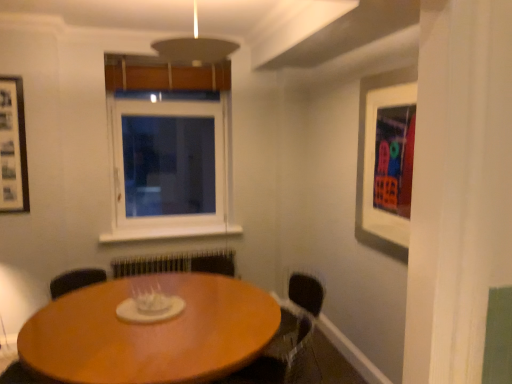
Question: Can you confirm if white matte picture frame at upper right, which is the 1th picture frame in front-to-back order, is shorter than white plastic window at center?

Choices:
 (A) no
 (B) yes

Answer: (B)

Question: Is the depth of white matte picture frame at upper right, which is the 1th picture frame in front-to-back order, greater than that of white plastic window at center?

Choices:
 (A) yes
 (B) no

Answer: (B)

Question: Is white matte picture frame at upper right, which appears as the 2th picture frame when viewed from the left, positioned beyond the bounds of white plastic window at center?

Choices:
 (A) yes
 (B) no

Answer: (A)

Question: Is white plastic window at center a part of white matte picture frame at upper right, marked as the second picture frame in a back-to-front arrangement?

Choices:
 (A) no
 (B) yes

Answer: (A)

Question: Is white matte picture frame at upper right, which appears as the 2th picture frame when viewed from the left, oriented towards white plastic window at center?

Choices:
 (A) no
 (B) yes

Answer: (A)

Question: Is white matte picture frame at upper right, which is the 1th picture frame in front-to-back order, bigger or smaller than wooden table at center?

Choices:
 (A) big
 (B) small

Answer: (B)

Question: Considering the positions of white matte picture frame at upper right, placed as the 1th picture frame when sorted from right to left, and wooden table at center in the image, is white matte picture frame at upper right, placed as the 1th picture frame when sorted from right to left, wider or thinner than wooden table at center?

Choices:
 (A) wide
 (B) thin

Answer: (B)

Question: From their relative heights in the image, would you say white matte picture frame at upper right, marked as the second picture frame in a back-to-front arrangement, is taller or shorter than wooden table at center?

Choices:
 (A) tall
 (B) short

Answer: (A)

Question: Visually, is white matte picture frame at upper right, marked as the second picture frame in a back-to-front arrangement, positioned to the left or to the right of wooden table at center?

Choices:
 (A) left
 (B) right

Answer: (B)

Question: In terms of width, does black matte picture frame at left, positioned as the first picture frame in left-to-right order, look wider or thinner when compared to white matte picture frame at upper right, which appears as the 2th picture frame when viewed from the left?

Choices:
 (A) thin
 (B) wide

Answer: (B)

Question: Which is correct: black matte picture frame at left, positioned as the first picture frame in left-to-right order, is inside white matte picture frame at upper right, marked as the second picture frame in a back-to-front arrangement, or outside of it?

Choices:
 (A) inside
 (B) outside

Answer: (B)

Question: Looking at the image, does black matte picture frame at left, placed as the 2th picture frame when sorted from right to left, seem bigger or smaller compared to white matte picture frame at upper right, which appears as the 2th picture frame when viewed from the left?

Choices:
 (A) big
 (B) small

Answer: (B)

Question: Is point (17, 142) positioned closer to the camera than point (375, 221)?

Choices:
 (A) farther
 (B) closer

Answer: (A)

Question: Looking at the image, does wooden table at center seem bigger or smaller compared to white matte picture frame at upper right, which is the 1th picture frame in front-to-back order?

Choices:
 (A) big
 (B) small

Answer: (A)

Question: In the image, is wooden table at center positioned in front of or behind white matte picture frame at upper right, which is the 1th picture frame in front-to-back order?

Choices:
 (A) front
 (B) behind

Answer: (A)